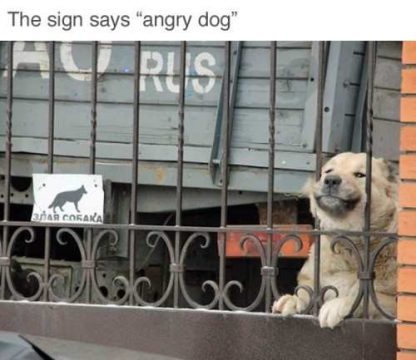
This screenshot has width=416, height=360. What are the coordinates of `wrought iron flourishes` in the screenshot? It's located at (184, 293), (98, 237), (52, 293).